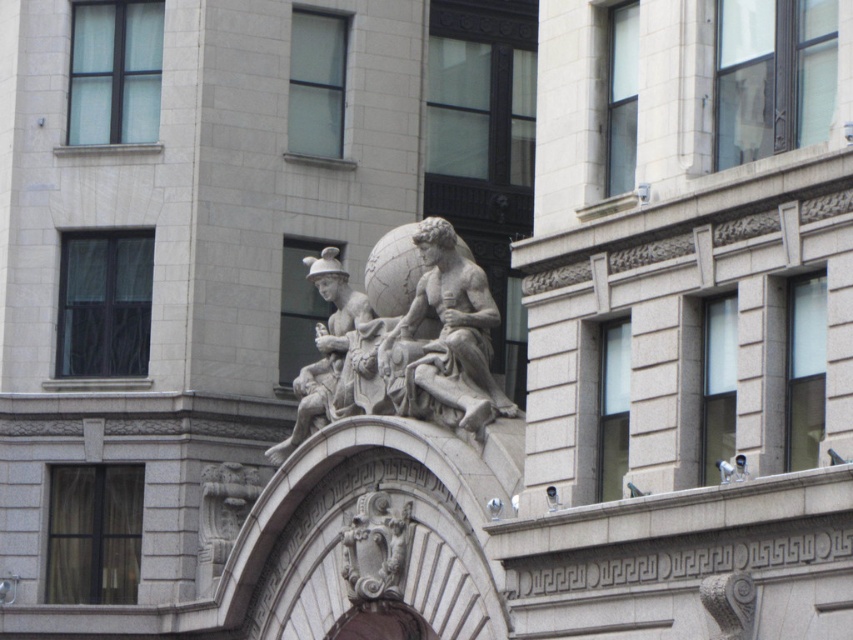
Is stone statue at center bigger than matte stone sculpture at center?

No, stone statue at center is not bigger than matte stone sculpture at center.

Which is below, stone statue at center or matte stone sculpture at center?

matte stone sculpture at center is lower down.

Measure the distance between point (421, 364) and camera.

Point (421, 364) and camera are 75.21 meters apart.

Where is `stone statue at center`? The height and width of the screenshot is (640, 853). stone statue at center is located at coordinates (438, 328).